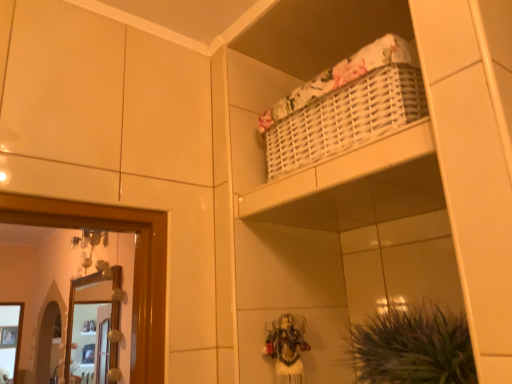
Question: Is wooden framed mirror at left shorter than green leafy plant at lower right?

Choices:
 (A) no
 (B) yes

Answer: (A)

Question: Does wooden framed mirror at left come in front of green leafy plant at lower right?

Choices:
 (A) yes
 (B) no

Answer: (B)

Question: From a real-world perspective, is wooden framed mirror at left beneath green leafy plant at lower right?

Choices:
 (A) yes
 (B) no

Answer: (B)

Question: Considering the relative sizes of wooden framed mirror at left and green leafy plant at lower right in the image provided, is wooden framed mirror at left wider than green leafy plant at lower right?

Choices:
 (A) yes
 (B) no

Answer: (B)

Question: Is wooden framed mirror at left far from green leafy plant at lower right?

Choices:
 (A) yes
 (B) no

Answer: (A)

Question: Could you tell me if wooden framed mirror at left is turned towards green leafy plant at lower right?

Choices:
 (A) no
 (B) yes

Answer: (A)

Question: Does green leafy plant at lower right have a greater width compared to wooden framed mirror at left?

Choices:
 (A) yes
 (B) no

Answer: (A)

Question: Is green leafy plant at lower right shorter than wooden framed mirror at left?

Choices:
 (A) no
 (B) yes

Answer: (B)

Question: Does green leafy plant at lower right appear on the right side of wooden framed mirror at left?

Choices:
 (A) no
 (B) yes

Answer: (B)

Question: From a real-world perspective, is green leafy plant at lower right beneath wooden framed mirror at left?

Choices:
 (A) no
 (B) yes

Answer: (B)

Question: Is green leafy plant at lower right bigger than wooden framed mirror at left?

Choices:
 (A) no
 (B) yes

Answer: (A)

Question: Is wooden framed mirror at left a part of green leafy plant at lower right?

Choices:
 (A) yes
 (B) no

Answer: (B)

Question: From a real-world perspective, relative to green leafy plant at lower right, is wooden framed mirror at left vertically above or below?

Choices:
 (A) above
 (B) below

Answer: (A)